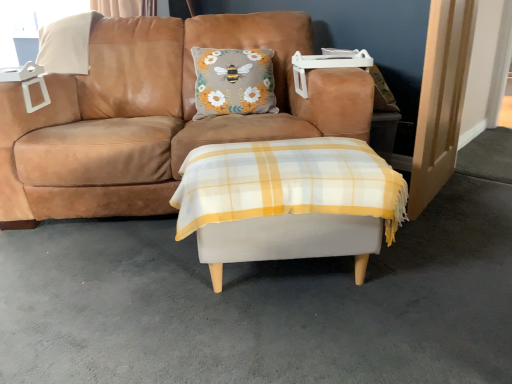
Question: Is suede tan couch at center situated inside white plastic window screen at upper left or outside?

Choices:
 (A) inside
 (B) outside

Answer: (B)

Question: Does point (32, 165) appear closer or farther from the camera than point (37, 26)?

Choices:
 (A) farther
 (B) closer

Answer: (B)

Question: Estimate the real-world distances between objects in this image. Which object is closer to the white fabric ottoman at center?

Choices:
 (A) suede tan couch at center
 (B) light wood door at right
 (C) white plastic window screen at upper left
 (D) white fabric ottoman at center

Answer: (D)

Question: Estimate the real-world distances between objects in this image. Which object is farther from the light wood door at right?

Choices:
 (A) white fabric ottoman at center
 (B) white plastic window screen at upper left
 (C) suede tan couch at center
 (D) white fabric ottoman at center

Answer: (B)